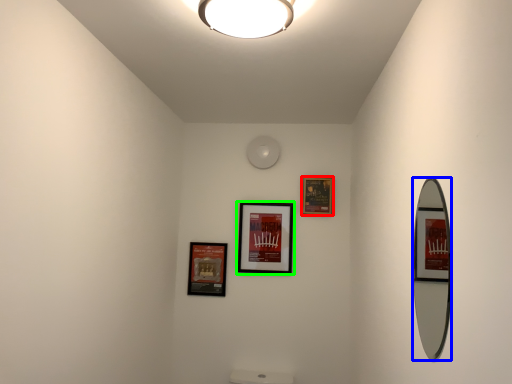
Question: Which object is the farthest from picture frame (highlighted by a red box)? Choose among these: mirror (highlighted by a blue box) or picture frame (highlighted by a green box).

Choices:
 (A) mirror
 (B) picture frame

Answer: (A)